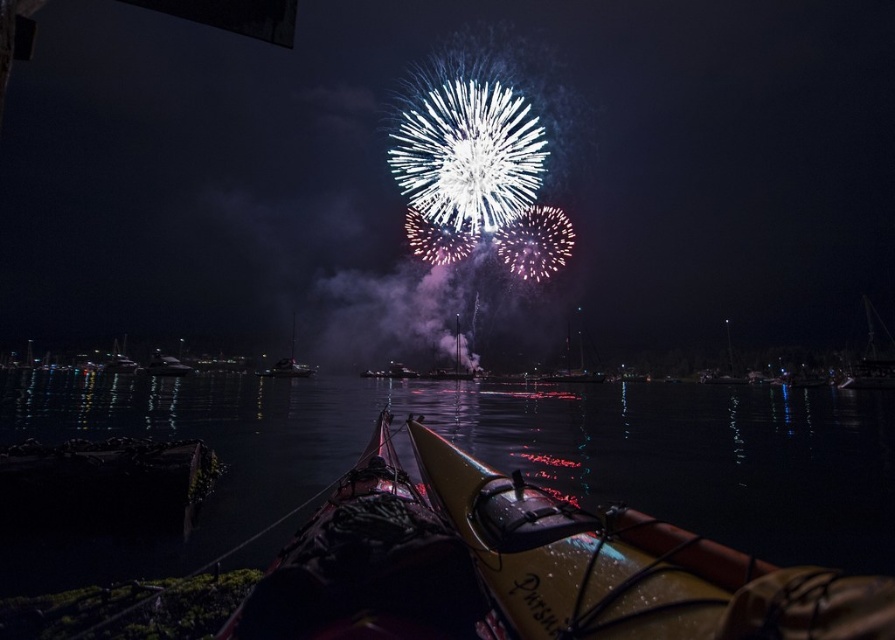
You are planning to store the metallic yellow kayak at center and the yellow matte canoe at center on a narrow rack that can only accommodate one of them. Which one should you choose to fit better?

The yellow matte canoe at center should be chosen because the metallic yellow kayak at center is wider than it, making the canoe more likely to fit on the narrow rack.

You are standing on the dock and want to retrieve your gear from the yellow matte canoe at center. To your right, there is a glossy water at center. Which direction should you move to reach the canoe?

The glossy water at center is to the left of the yellow matte canoe at center, so you should move to your right to reach the canoe.

Looking at this image, you are a photographer standing on the dock at the marina. You want to capture a photo of the glossy water at center and the yellow matte canoe at center in the same frame. Your camera has a maximum focus range of 60 meters. Will both objects be in focus?

The glossy water at center and yellow matte canoe at center are 60.88 meters apart. Since the distance between them exceeds the camera maximum focus range of 60 meters, both objects may not be in focus simultaneously.